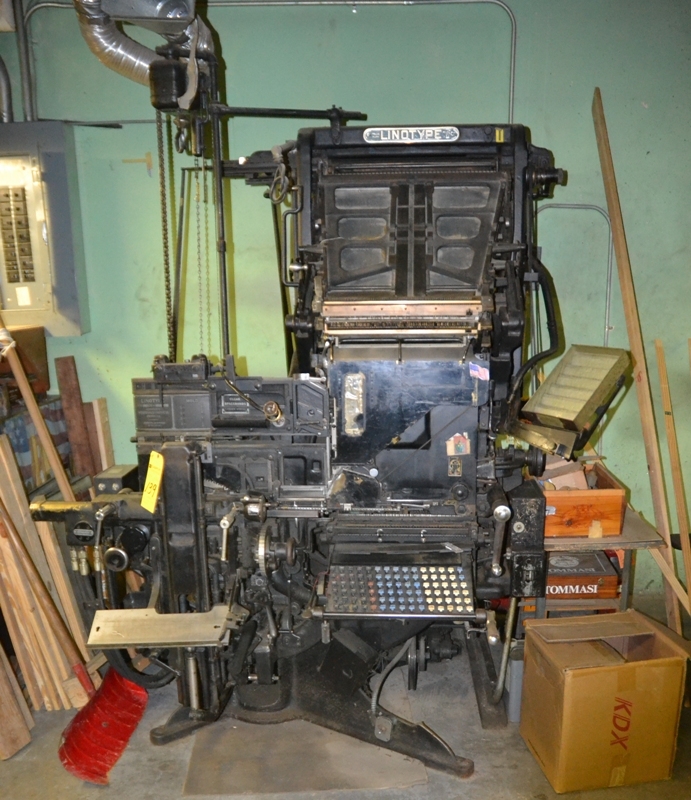
At what (x,y) coordinates should I click in order to perform the action: click on wooden box. Please return your answer as a coordinate pair (x, y). This screenshot has height=800, width=691. Looking at the image, I should click on (583, 574).